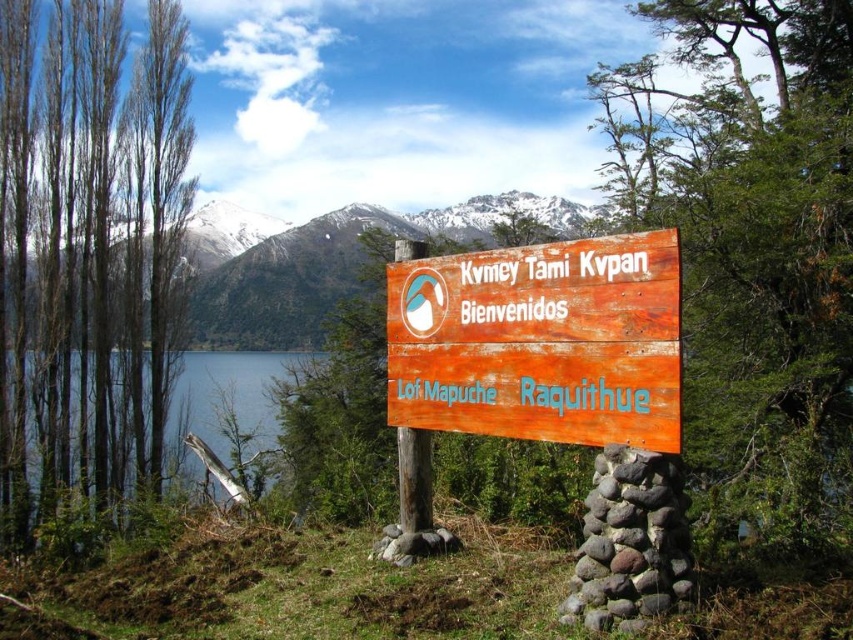
You are a hiker who wants to take a photo of the wooden sign at center and the blue water at left. Which object will appear smaller in your photo?

The wooden sign at center occupies less space than blue water at left, so it will appear smaller in the photo.